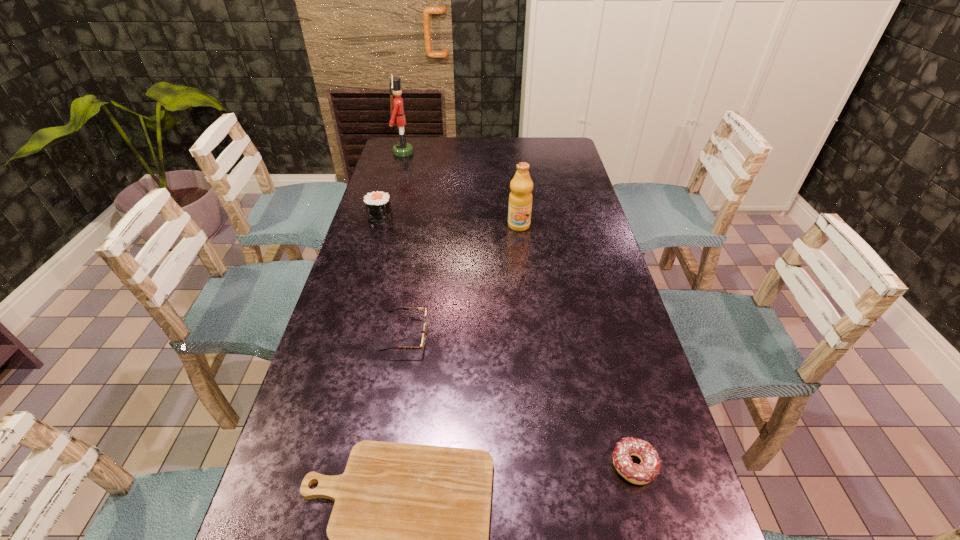
At what (x,y) coordinates should I click in order to perform the action: click on vacant space located 0.140m on the frame of the fourth farthest object. Please return your answer as a coordinate pair (x, y). The height and width of the screenshot is (540, 960). Looking at the image, I should click on (480, 336).

The height and width of the screenshot is (540, 960). I want to click on free location located on the left of the rightmost object, so click(x=504, y=465).

Find the location of `object at the far edge`. object at the far edge is located at coordinates (402, 149).

Identify the location of nutcracker located at the left edge. (402, 149).

Locate an element on the screen. The height and width of the screenshot is (540, 960). sushi situated at the left edge is located at coordinates (378, 207).

Image resolution: width=960 pixels, height=540 pixels. What are the coordinates of `object that is at the right edge` in the screenshot? It's located at (649, 468).

Find the location of `object situated at the far left corner`. object situated at the far left corner is located at coordinates (402, 149).

The height and width of the screenshot is (540, 960). In the image, there is a desktop. In order to click on vacant area at the far edge in this screenshot , I will do `click(492, 150)`.

Locate an element on the screen. free space at the left edge is located at coordinates (357, 295).

The width and height of the screenshot is (960, 540). I want to click on vacant space at the right edge, so click(x=593, y=379).